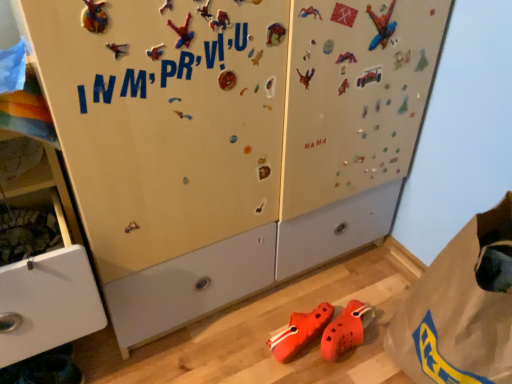
Question: Is brown paper bag at lower right smaller than matte white cabinet at left?

Choices:
 (A) yes
 (B) no

Answer: (A)

Question: Is brown paper bag at lower right at the left side of matte white cabinet at left?

Choices:
 (A) no
 (B) yes

Answer: (A)

Question: Can you confirm if brown paper bag at lower right is positioned to the right of matte white cabinet at left?

Choices:
 (A) no
 (B) yes

Answer: (B)

Question: From a real-world perspective, is brown paper bag at lower right physically above matte white cabinet at left?

Choices:
 (A) yes
 (B) no

Answer: (B)

Question: From the image's perspective, is brown paper bag at lower right on top of matte white cabinet at left?

Choices:
 (A) yes
 (B) no

Answer: (B)

Question: Is orange rubber clogs at lower center in front of or behind brown paper bag at lower right in the image?

Choices:
 (A) front
 (B) behind

Answer: (B)

Question: Which is correct: orange rubber clogs at lower center is inside brown paper bag at lower right, or outside of it?

Choices:
 (A) inside
 (B) outside

Answer: (B)

Question: Considering the positions of point (344, 309) and point (471, 311), is point (344, 309) closer or farther from the camera than point (471, 311)?

Choices:
 (A) closer
 (B) farther

Answer: (B)

Question: Considering the positions of orange rubber clogs at lower center and brown paper bag at lower right in the image, is orange rubber clogs at lower center bigger or smaller than brown paper bag at lower right?

Choices:
 (A) big
 (B) small

Answer: (B)

Question: Choose the correct answer: Is orange rubber clogs at lower center inside matte white cabinet at left or outside it?

Choices:
 (A) inside
 (B) outside

Answer: (B)

Question: Is orange rubber clogs at lower center in front of or behind matte white cabinet at left in the image?

Choices:
 (A) front
 (B) behind

Answer: (B)

Question: Considering the relative positions of orange rubber clogs at lower center and matte white cabinet at left in the image provided, is orange rubber clogs at lower center to the left or to the right of matte white cabinet at left?

Choices:
 (A) left
 (B) right

Answer: (B)

Question: Considering the positions of orange rubber clogs at lower center and matte white cabinet at left in the image, is orange rubber clogs at lower center wider or thinner than matte white cabinet at left?

Choices:
 (A) wide
 (B) thin

Answer: (B)

Question: Considering the positions of matte white cabinet at left and brown paper bag at lower right in the image, is matte white cabinet at left bigger or smaller than brown paper bag at lower right?

Choices:
 (A) big
 (B) small

Answer: (A)

Question: Is point (54, 248) positioned closer to the camera than point (484, 288)?

Choices:
 (A) closer
 (B) farther

Answer: (A)